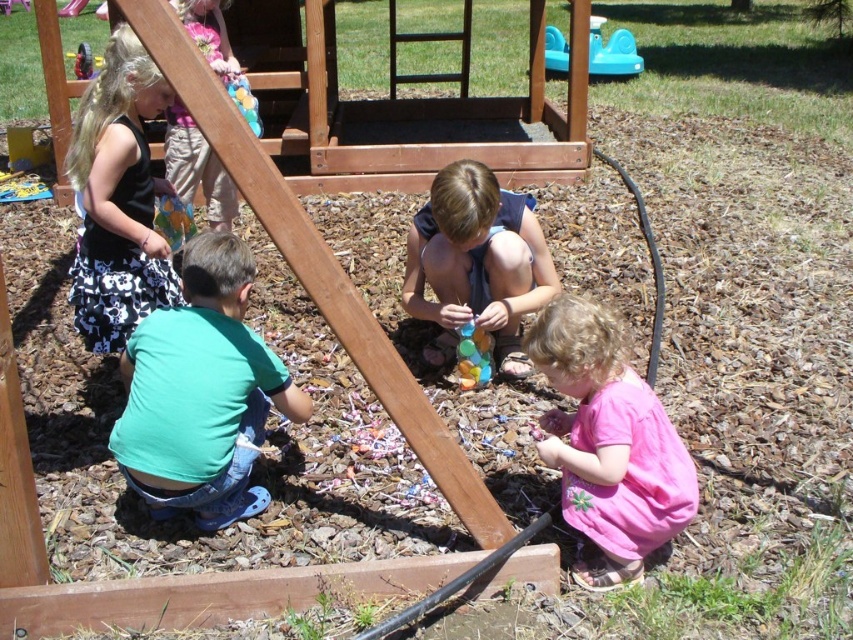
Who is taller, shiny blue beads at center or translucent plastic beads at center?

With more height is shiny blue beads at center.

Does point (486, 195) come behind point (473, 330)?

No, (486, 195) is in front of (473, 330).

Where is `shiny blue beads at center`? This screenshot has height=640, width=853. shiny blue beads at center is located at coordinates (477, 262).

Locate an element on the screen. shiny blue beads at center is located at coordinates (477, 262).

Is the position of green matte shirt at lower left more distant than that of teal plastic toy at upper right?

No, green matte shirt at lower left is closer to the viewer.

Between green matte shirt at lower left and teal plastic toy at upper right, which one is positioned higher?

teal plastic toy at upper right is higher up.

Between point (244, 362) and point (619, 38), which one is positioned behind?

The point (619, 38) is behind.

This screenshot has width=853, height=640. Identify the location of green matte shirt at lower left. (201, 392).

Is point (614, 54) positioned in front of point (82, 60)?

No, (614, 54) is further to viewer.

Who is positioned more to the left, teal plastic toy at upper right or wooden swing at upper left?

Positioned to the left is wooden swing at upper left.

Identify the location of teal plastic toy at upper right. (612, 51).

This screenshot has width=853, height=640. I want to click on teal plastic toy at upper right, so point(612,51).